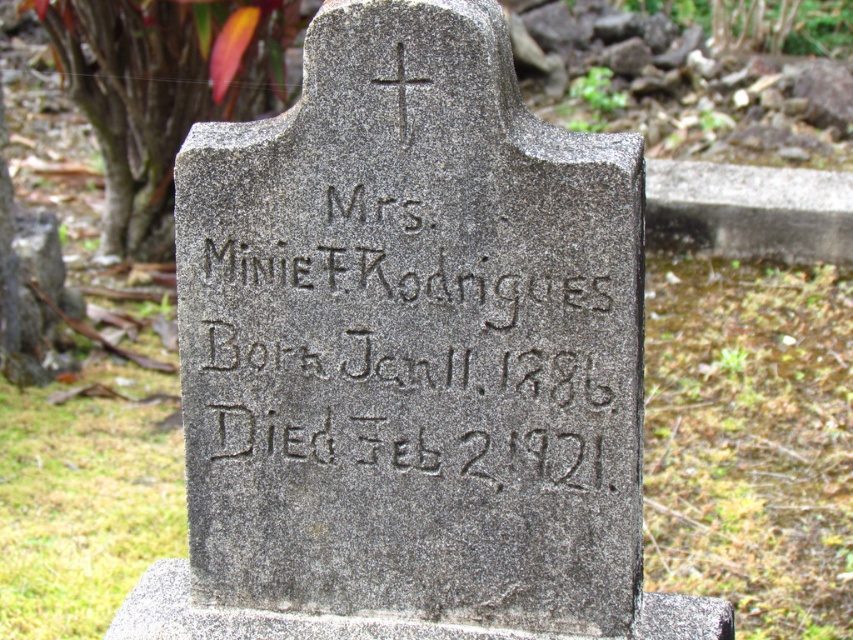
Question: Which of the following is the closest to the observer?

Choices:
 (A) (637, 621)
 (B) (583, 333)

Answer: (B)

Question: Does gray stone gravestone at center have a lesser width compared to gray stone inscription at center?

Choices:
 (A) no
 (B) yes

Answer: (A)

Question: Does gray stone gravestone at center appear under gray stone inscription at center?

Choices:
 (A) yes
 (B) no

Answer: (A)

Question: Which point is farther to the camera?

Choices:
 (A) gray stone inscription at center
 (B) gray stone gravestone at center

Answer: (A)

Question: Which object appears closest to the camera in this image?

Choices:
 (A) gray stone gravestone at center
 (B) gray stone inscription at center

Answer: (A)

Question: Can you confirm if gray stone gravestone at center is positioned above gray stone inscription at center?

Choices:
 (A) no
 (B) yes

Answer: (A)